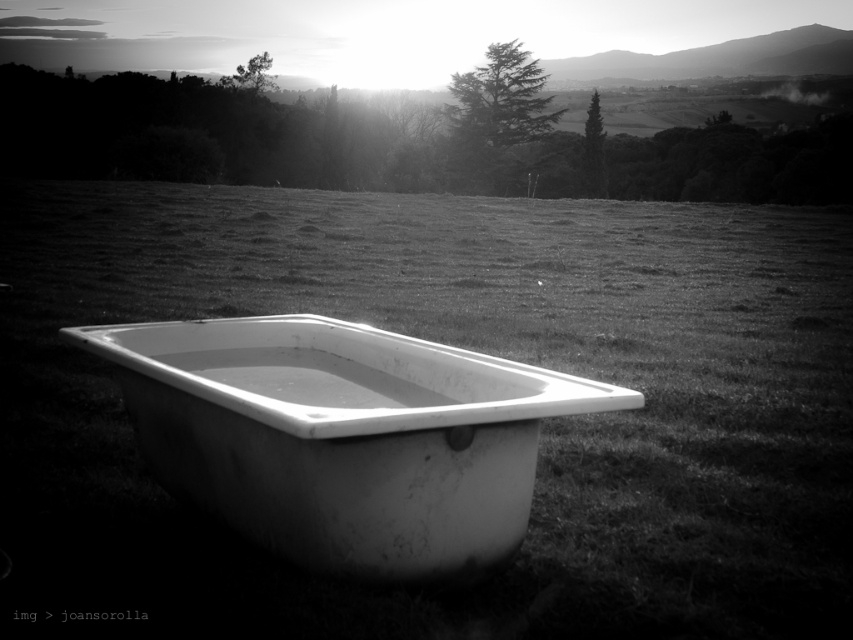
Question: Can you confirm if smooth grass at center is thinner than white matte bathtub at center?

Choices:
 (A) yes
 (B) no

Answer: (B)

Question: Which of the following is the farthest from the observer?

Choices:
 (A) smooth grass at center
 (B) white matte bathtub at center

Answer: (A)

Question: Which point appears farthest from the camera in this image?

Choices:
 (A) (778, 276)
 (B) (293, 340)

Answer: (A)

Question: Can you confirm if smooth grass at center is bigger than white matte bathtub at center?

Choices:
 (A) yes
 (B) no

Answer: (A)

Question: From the image, what is the correct spatial relationship of smooth grass at center in relation to white matte bathtub at center?

Choices:
 (A) above
 (B) below

Answer: (A)

Question: Which object appears closest to the camera in this image?

Choices:
 (A) white matte bathtub at center
 (B) smooth grass at center

Answer: (A)